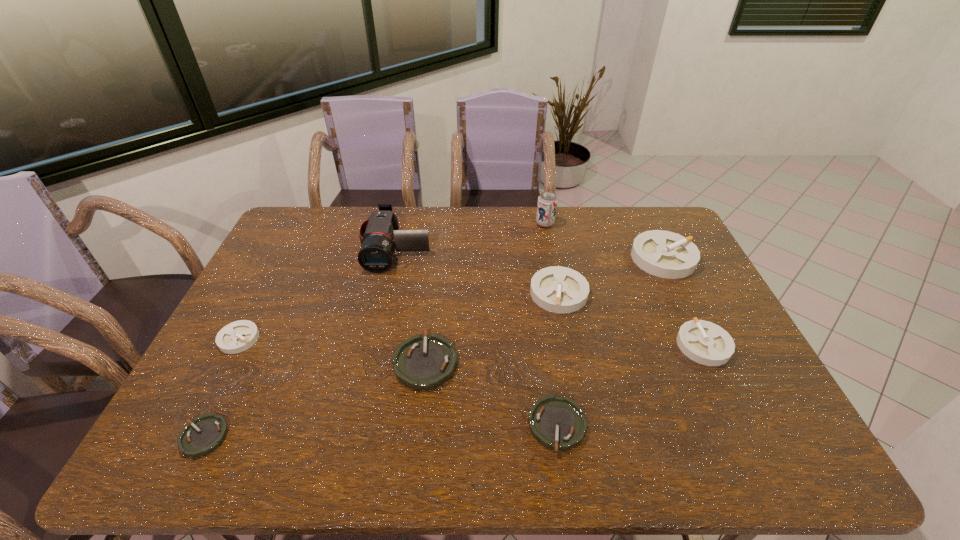
Find the location of `free space located 0.300m on the right of the smallest gray ashtray`. free space located 0.300m on the right of the smallest gray ashtray is located at coordinates (365, 339).

You are a GUI agent. You are given a task and a screenshot of the screen. Output one action in this format:
    pyautogui.click(x=<x>, y=<y>)
    Task: Click on the vacant space situated on the left of the second biggest green ashtray
    Image resolution: width=960 pixels, height=540 pixels.
    Given the screenshot: What is the action you would take?
    pyautogui.click(x=440, y=426)

Find the location of a particular element. This screenshot has height=540, width=960. free region located 0.220m on the back of the leftmost green ashtray is located at coordinates (250, 345).

Identify the location of beer can situated at the far edge. (547, 201).

I want to click on camcorder positioned at the far edge, so click(379, 235).

Locate an element on the screen. The width and height of the screenshot is (960, 540). ashtray located in the far edge section of the desktop is located at coordinates (665, 254).

Where is `object that is at the near left corner`? object that is at the near left corner is located at coordinates 207,432.

Where is `object located at the far right corner`? The image size is (960, 540). object located at the far right corner is located at coordinates coord(665,254).

The width and height of the screenshot is (960, 540). In the image, there is a desktop. Identify the location of vacant space at the far edge. (413, 226).

In the image, there is a desktop. Identify the location of vacant space at the near edge. The image size is (960, 540). (607, 444).